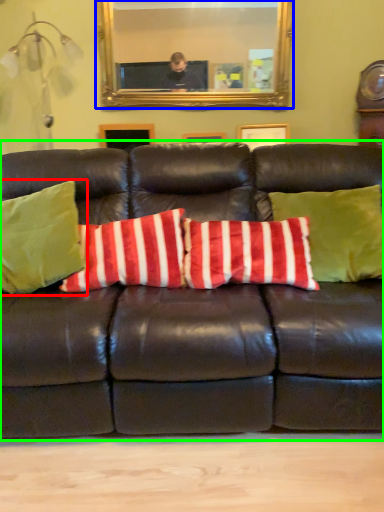
Question: Considering the real-world distances, which object is closest to pillow (highlighted by a red box)? mirror (highlighted by a blue box) or studio couch (highlighted by a green box).

Choices:
 (A) mirror
 (B) studio couch

Answer: (B)